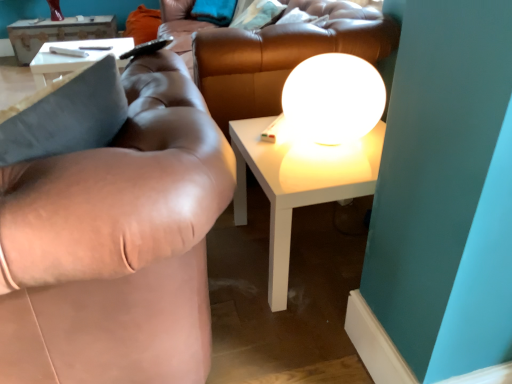
Question: Is brown leather couch at center spatially inside brown leather couch at left, or outside of it?

Choices:
 (A) inside
 (B) outside

Answer: (B)

Question: Looking at the image, does brown leather couch at center seem bigger or smaller compared to brown leather couch at left?

Choices:
 (A) small
 (B) big

Answer: (B)

Question: Which is farther from the white glossy table at upper left, the second table positioned from the front?

Choices:
 (A) white glossy sphere at upper center
 (B) orange fabric pillow at upper left, which appears as the 1th pillow when viewed from the left
 (C) brown leather couch at left
 (D) white glossy table at center, the first table from the front
 (E) brown leather couch at center

Answer: (C)

Question: Which is farther from the soft teal pillow at upper center, arranged as the 1th pillow when viewed from the front?

Choices:
 (A) orange fabric pillow at upper left, the 2th pillow from the front
 (B) white glossy sphere at upper center
 (C) brown leather couch at left
 (D) brown leather couch at center
 (E) white glossy table at upper left, the 1th table in the top-to-bottom sequence

Answer: (C)